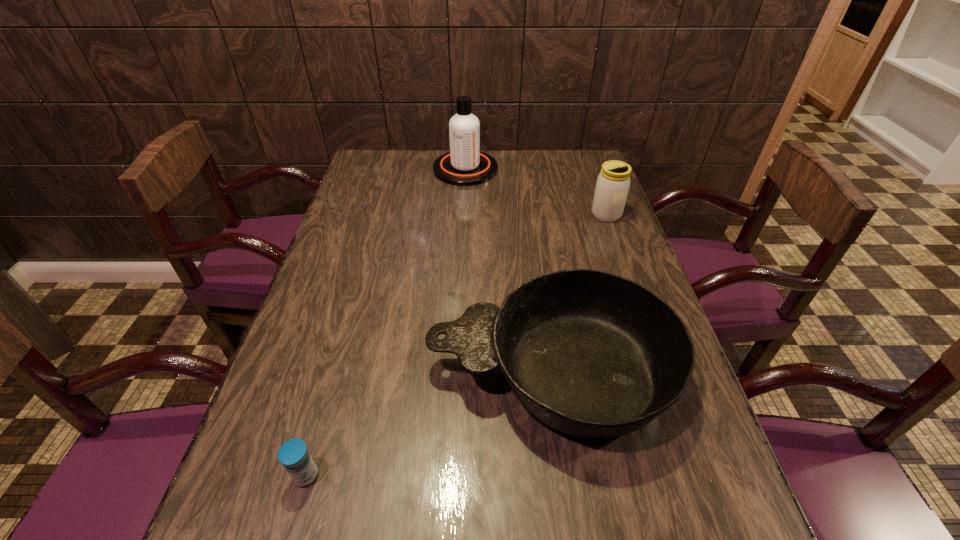
Locate an element on the screen. Image resolution: width=960 pixels, height=540 pixels. vacant area situated 0.250m with the handle extending from the side of the frying pan is located at coordinates (310, 373).

In order to click on free space located with the handle extending from the side of the frying pan in this screenshot , I will do `click(357, 373)`.

Find the location of a particular element. vacant region located 0.140m with the handle extending from the side of the frying pan is located at coordinates (362, 373).

Locate an element on the screen. This screenshot has height=540, width=960. free space located 0.070m on the back of the shortest object is located at coordinates (320, 427).

The image size is (960, 540). In order to click on object at the far edge in this screenshot , I will do `click(464, 165)`.

This screenshot has width=960, height=540. In order to click on object positioned at the left edge in this screenshot , I will do `click(293, 454)`.

Where is `jar present at the right edge`? The image size is (960, 540). jar present at the right edge is located at coordinates (613, 182).

The image size is (960, 540). Identify the location of frying pan situated at the right edge. (591, 354).

In the image, there is a desktop. Where is `vacant area at the far edge`? The image size is (960, 540). vacant area at the far edge is located at coordinates (528, 166).

You are a GUI agent. You are given a task and a screenshot of the screen. Output one action in this format:
    pyautogui.click(x=<x>, y=<y>)
    Task: Click on the vacant position at the left edge of the desktop
    The image size is (960, 540).
    Given the screenshot: What is the action you would take?
    pyautogui.click(x=328, y=324)